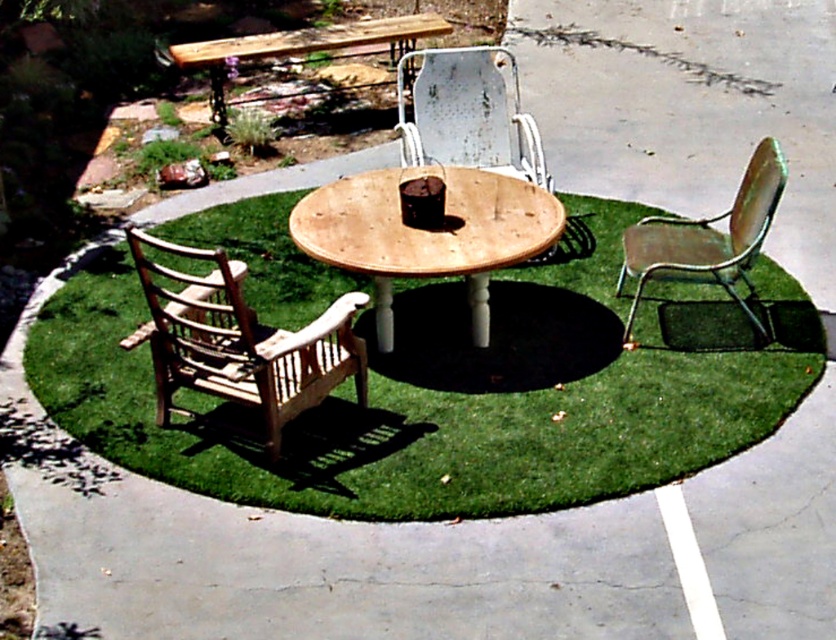
You are planning to place a new decorative item on the natural wood table at center. Based on the scene description, where would the green artificial grass at center be in relation to the table?

The green artificial grass at center is located below the natural wood table at center, so placing the decorative item on the table won

You are sitting on the rusty metal chair at center and want to place a book on the wooden table at upper center. Can you reach the table without standing up?

The rusty metal chair at center is not as tall as wooden table at upper center, so you might need to stand up to reach it comfortably.